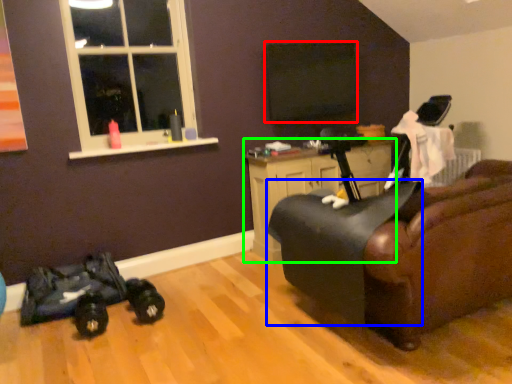
Question: Which object is the farthest from window screen (highlighted by a red box)? Choose among these: swivel chair (highlighted by a blue box) or cabinetry (highlighted by a green box).

Choices:
 (A) swivel chair
 (B) cabinetry

Answer: (A)